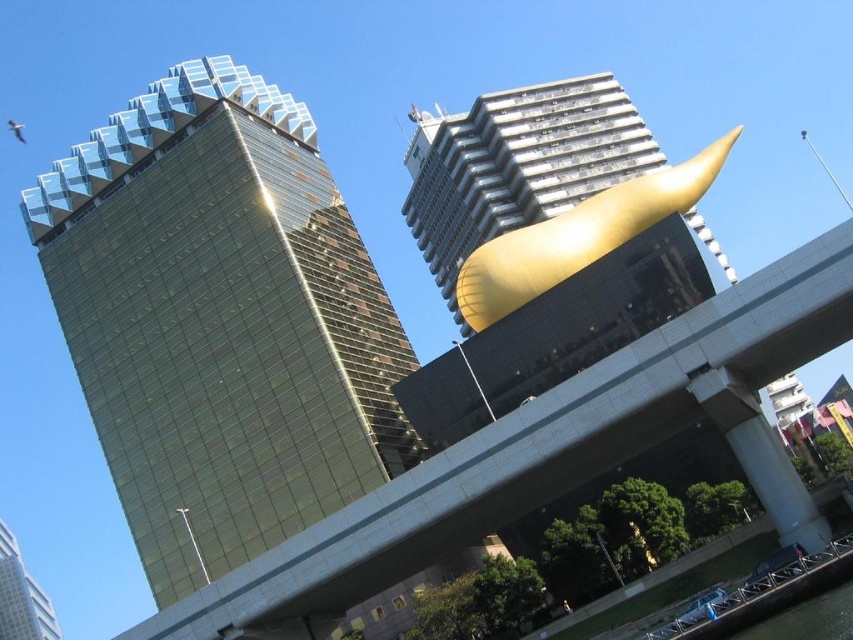
Can you confirm if gold metallic sculpture at upper right is positioned to the left of matte glass skyscraper at center?

In fact, gold metallic sculpture at upper right is to the right of matte glass skyscraper at center.

Does point (531, 186) lie in front of point (6, 579)?

Yes, it is in front of point (6, 579).

Is point (593, 113) closer to camera compared to point (41, 600)?

Yes.

Image resolution: width=853 pixels, height=640 pixels. I want to click on gold metallic sculpture at upper right, so click(x=517, y=166).

Which is in front, point (300, 141) or point (15, 609)?

Point (300, 141) is in front.

Who is taller, shiny glass skyscraper at left or matte glass skyscraper at center?

shiny glass skyscraper at left

Is point (350, 449) closer to camera compared to point (1, 545)?

Yes.

Where is `shiny glass skyscraper at left`? The image size is (853, 640). shiny glass skyscraper at left is located at coordinates (219, 320).

Between matte glass skyscraper at center and black rubber waterway at lower right, which one is positioned higher?

black rubber waterway at lower right is higher up.

Does matte glass skyscraper at center have a lesser width compared to black rubber waterway at lower right?

No, matte glass skyscraper at center is not thinner than black rubber waterway at lower right.

Where is `matte glass skyscraper at center`? The height and width of the screenshot is (640, 853). matte glass skyscraper at center is located at coordinates (21, 596).

The height and width of the screenshot is (640, 853). I want to click on matte glass skyscraper at center, so click(21, 596).